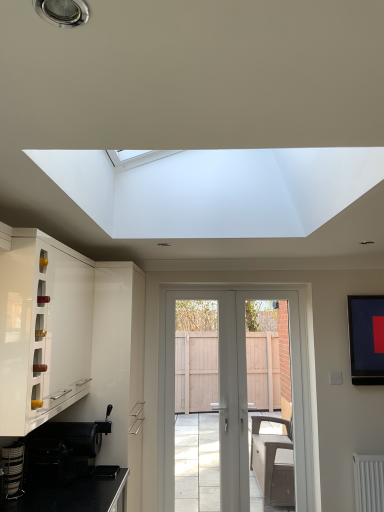
Question: Does white glossy cabinet at left have a larger size compared to white plastic screen door at center?

Choices:
 (A) no
 (B) yes

Answer: (B)

Question: From a real-world perspective, does white glossy cabinet at left sit lower than white plastic screen door at center?

Choices:
 (A) yes
 (B) no

Answer: (B)

Question: Is white glossy cabinet at left not inside white plastic screen door at center?

Choices:
 (A) no
 (B) yes

Answer: (B)

Question: From a real-world perspective, is white glossy cabinet at left over white plastic screen door at center?

Choices:
 (A) yes
 (B) no

Answer: (A)

Question: Are white glossy cabinet at left and white plastic screen door at center far apart?

Choices:
 (A) no
 (B) yes

Answer: (B)

Question: In the image, is white glossy door at center on the left side or the right side of white glossy cabinet at left?

Choices:
 (A) left
 (B) right

Answer: (B)

Question: In terms of size, does white glossy door at center appear bigger or smaller than white glossy cabinet at left?

Choices:
 (A) small
 (B) big

Answer: (A)

Question: Is white glossy door at center taller or shorter than white glossy cabinet at left?

Choices:
 (A) short
 (B) tall

Answer: (B)

Question: From the image's perspective, is white glossy door at center located above or below white glossy cabinet at left?

Choices:
 (A) above
 (B) below

Answer: (B)

Question: Does point (170, 330) appear closer or farther from the camera than point (16, 448)?

Choices:
 (A) farther
 (B) closer

Answer: (A)

Question: Do you think white glossy door at center is within metallic silver coffee machine at lower left, or outside of it?

Choices:
 (A) outside
 (B) inside

Answer: (A)

Question: In terms of width, does white glossy door at center look wider or thinner when compared to metallic silver coffee machine at lower left?

Choices:
 (A) thin
 (B) wide

Answer: (A)

Question: From a real-world perspective, is white glossy door at center physically located above or below metallic silver coffee machine at lower left?

Choices:
 (A) below
 (B) above

Answer: (B)

Question: Looking at their shapes, would you say white glossy cabinet at left is wider or thinner than metallic silver coffee machine at lower left?

Choices:
 (A) wide
 (B) thin

Answer: (A)

Question: Is white glossy cabinet at left inside the boundaries of metallic silver coffee machine at lower left, or outside?

Choices:
 (A) outside
 (B) inside

Answer: (A)